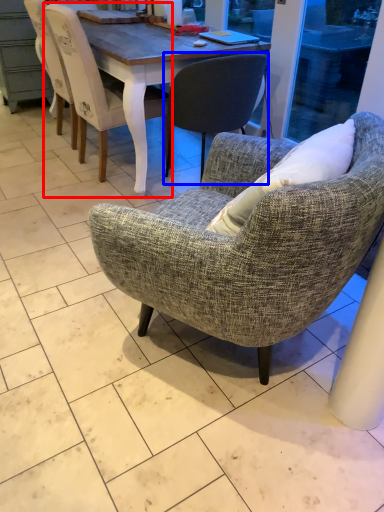
Question: Which of the following is the farthest to the observer, chair (highlighted by a red box) or chair (highlighted by a blue box)?

Choices:
 (A) chair
 (B) chair

Answer: (A)